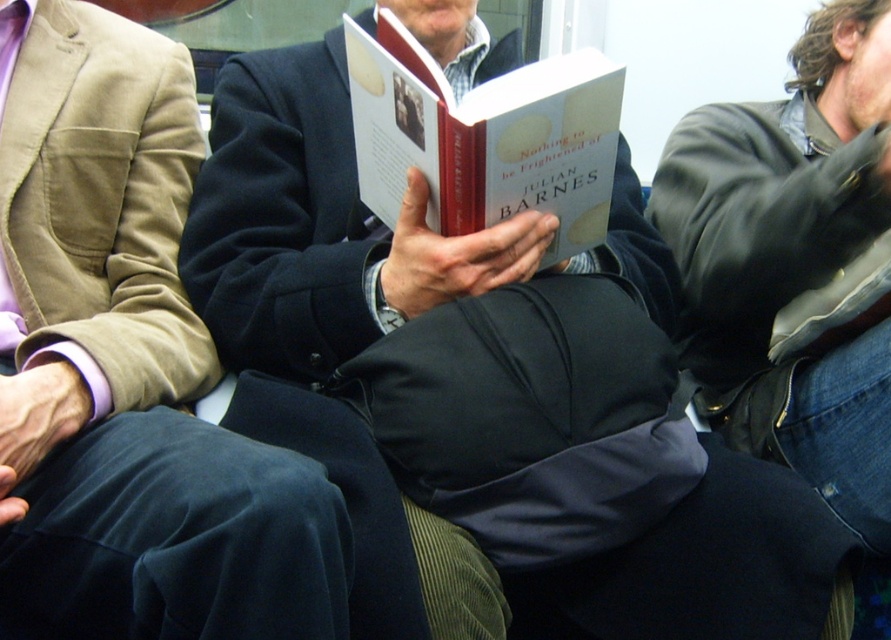
Question: Among these objects, which one is farthest from the camera?

Choices:
 (A) hardcover book at center
 (B) leather jacket at right

Answer: (B)

Question: Which point appears closest to the camera in this image?

Choices:
 (A) (489, 204)
 (B) (848, 340)
 (C) (90, 432)

Answer: (C)

Question: Can you confirm if leather jacket at right is positioned below hardcover book at center?

Choices:
 (A) no
 (B) yes

Answer: (B)

Question: Is leather jacket at right below hardcover book at center?

Choices:
 (A) no
 (B) yes

Answer: (B)

Question: Is leather jacket at right above hardcover book at center?

Choices:
 (A) no
 (B) yes

Answer: (A)

Question: Estimate the real-world distances between objects in this image. Which object is closer to the matte black jacket at center?

Choices:
 (A) leather jacket at right
 (B) hardcover book at center

Answer: (B)